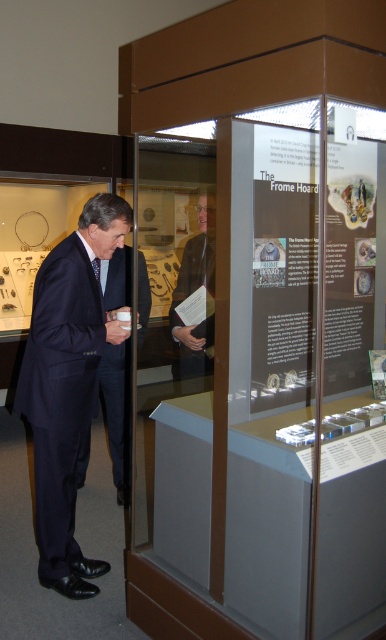
Does navy blue suit at left appear on the right side of matte brown jacket at center?

Incorrect, navy blue suit at left is not on the right side of matte brown jacket at center.

Does point (71, 547) lie in front of point (182, 336)?

Yes, it is in front of point (182, 336).

Which is behind, point (142, 275) or point (177, 337)?

The point (142, 275) is more distant.

The width and height of the screenshot is (386, 640). What are the coordinates of `navy blue suit at left` in the screenshot? It's located at (76, 380).